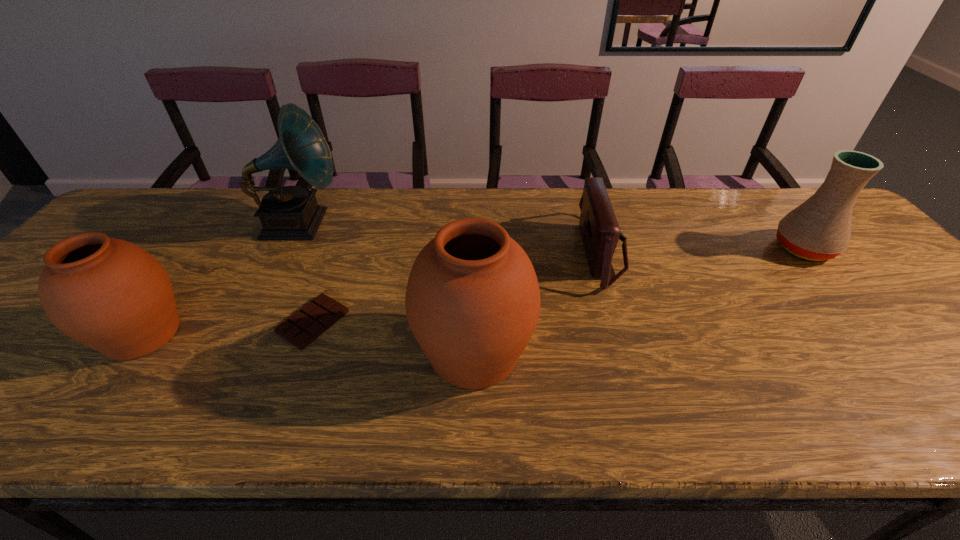
Identify the location of free point that satisfies the following two spatial constraints: 1. on the front flap of the shoulder bag; 2. on the front side of the right urn. The image size is (960, 540). (x=634, y=353).

Where is `free spot that satisfies the following two spatial constraints: 1. from the horn of the phonograph_record; 2. on the right side of the shortest object`? Image resolution: width=960 pixels, height=540 pixels. free spot that satisfies the following two spatial constraints: 1. from the horn of the phonograph_record; 2. on the right side of the shortest object is located at coordinates (250, 322).

In order to click on free spot that satisfies the following two spatial constraints: 1. from the horn of the phonograph_record; 2. on the left side of the taller urn in this screenshot , I will do `click(234, 353)`.

Find the location of a particular element. This screenshot has width=960, height=540. vacant space that satisfies the following two spatial constraints: 1. from the horn of the phonograph_record; 2. on the left side of the shortest object is located at coordinates (250, 322).

In order to click on vacant area that satisfies the following two spatial constraints: 1. from the horn of the shortest object; 2. on the left side of the phonograph_record in this screenshot , I will do `click(250, 322)`.